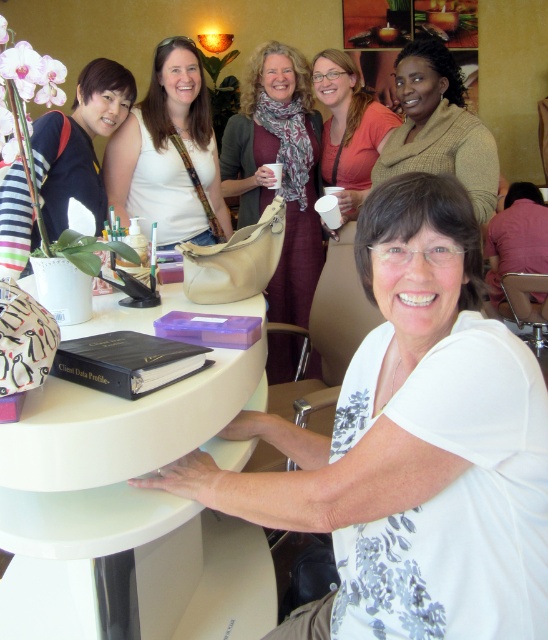
Question: Does white glossy round table at center have a greater width compared to matte white mug at upper center?

Choices:
 (A) no
 (B) yes

Answer: (B)

Question: Which point is farther from the camera taking this photo?

Choices:
 (A) (386, 289)
 (B) (164, 99)

Answer: (B)

Question: Which point is closer to the camera?

Choices:
 (A) (272, 42)
 (B) (425, 116)
 (C) (179, 451)
 (D) (324, 72)

Answer: (C)

Question: Can you confirm if matte brown scarf at center is wider than brown wool sweater at upper right?

Choices:
 (A) yes
 (B) no

Answer: (A)

Question: Which point is farther from the camera taking this photo?

Choices:
 (A) (413, 228)
 (B) (219, 589)
 (C) (147, 163)
 (D) (358, 104)

Answer: (D)

Question: Is matte white purse at upper center thinner than brown wool sweater at upper right?

Choices:
 (A) no
 (B) yes

Answer: (A)